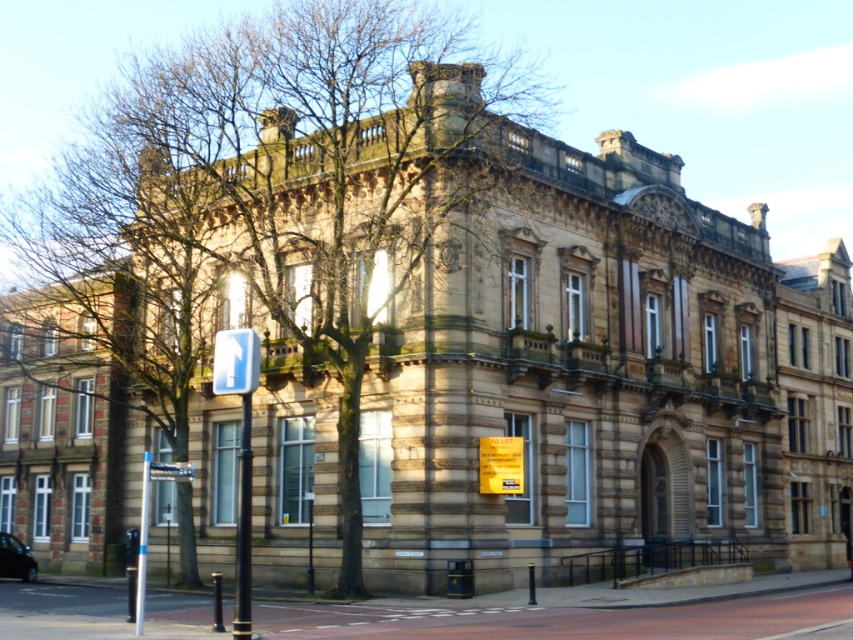
Between shiny black car at lower left and white plastic sign at center, which one is positioned lower?

Positioned lower is shiny black car at lower left.

Does shiny black car at lower left come in front of white plastic sign at center?

No, it is not.

In order to click on shiny black car at lower left in this screenshot , I will do `click(15, 557)`.

Where is `shiny black car at lower left`? The width and height of the screenshot is (853, 640). shiny black car at lower left is located at coordinates pos(15,557).

Does brown textured tree at center have a greater width compared to white plastic sign at center?

Yes.

Does point (59, 259) come closer to viewer compared to point (189, 477)?

No.

Find the location of a particular element. brown textured tree at center is located at coordinates (270, 196).

Is brown textured tree at center wider than shiny black car at lower left?

Indeed, brown textured tree at center has a greater width compared to shiny black car at lower left.

Who is taller, brown textured tree at center or shiny black car at lower left?

Standing taller between the two is brown textured tree at center.

Find the location of a particular element. The height and width of the screenshot is (640, 853). brown textured tree at center is located at coordinates (270, 196).

Find the location of `brown textured tree at center`. brown textured tree at center is located at coordinates (270, 196).